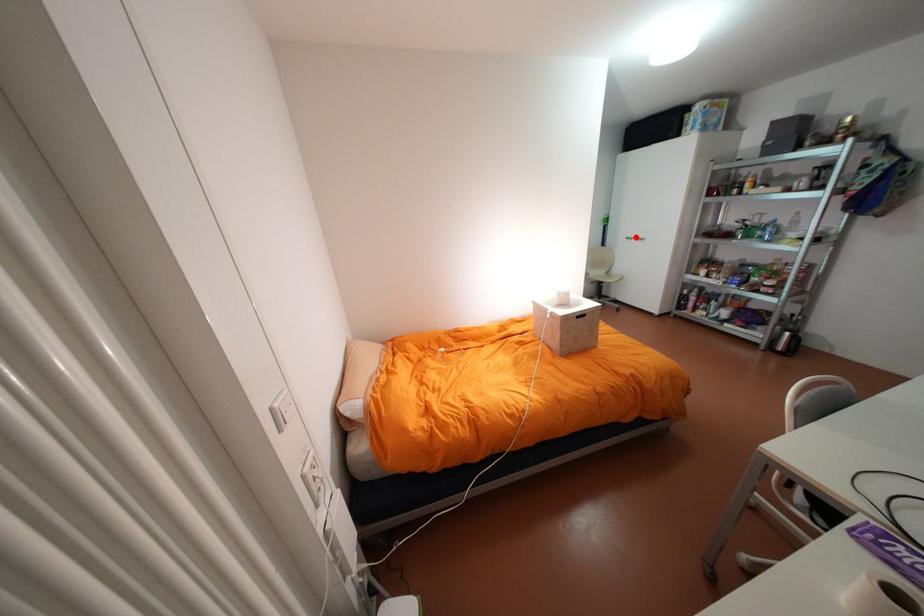
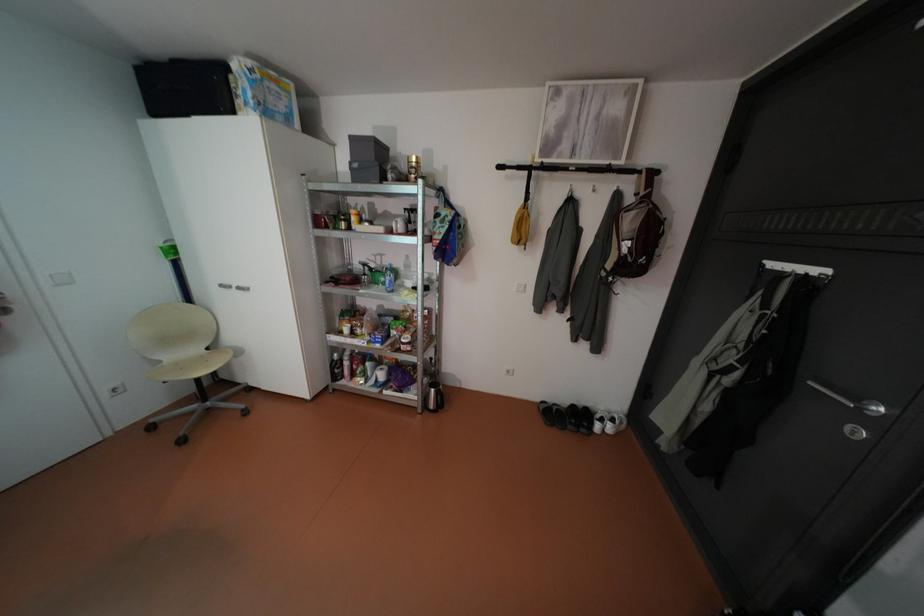
In the second image, find the point that corresponds to the highlighted location in the first image.

(232, 285)